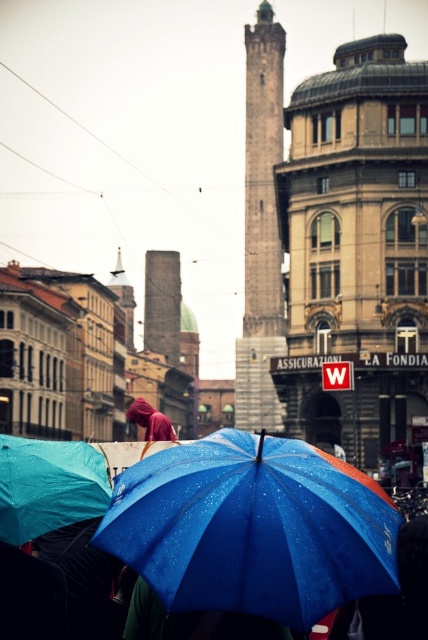
You are a pedestrian trying to cross the street in the image. You see the blue glossy umbrella at center and the blue matte umbrella at lower center. Which umbrella is positioned to the right of the other?

The blue glossy umbrella at center is positioned to the right of the blue matte umbrella at lower center.

You are a photographer trying to capture both the blue glossy umbrella at center and the blue matte umbrella at lower center in a single shot. Given their sizes, which one will appear bigger in the photo?

The blue glossy umbrella at center will appear bigger in the photo because it is larger in size than the blue matte umbrella at lower center.